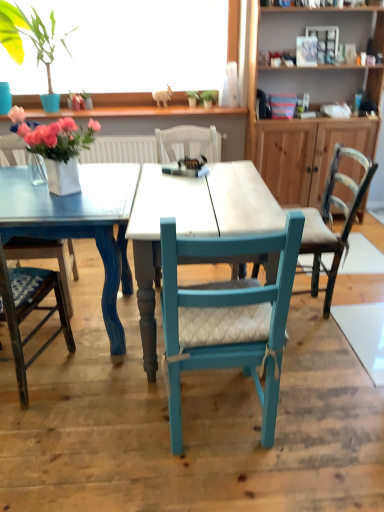
Question: Considering the relative positions of matte pink flowers at left and blue fabric cushioned chair at left, arranged as the 2th chair when viewed from the left, in the image provided, is matte pink flowers at left in front of blue fabric cushioned chair at left, arranged as the 2th chair when viewed from the left,?

Choices:
 (A) no
 (B) yes

Answer: (A)

Question: Considering the relative sizes of matte pink flowers at left and blue fabric cushioned chair at left, arranged as the 2th chair when viewed from the left, in the image provided, is matte pink flowers at left thinner than blue fabric cushioned chair at left, arranged as the 2th chair when viewed from the left,?

Choices:
 (A) no
 (B) yes

Answer: (B)

Question: Can you confirm if matte pink flowers at left is positioned to the left of blue fabric cushioned chair at left, arranged as the 2th chair when viewed from the left?

Choices:
 (A) yes
 (B) no

Answer: (B)

Question: Is matte pink flowers at left outside blue fabric cushioned chair at left, arranged as the 2th chair when viewed from the left?

Choices:
 (A) yes
 (B) no

Answer: (A)

Question: Considering the relative sizes of matte pink flowers at left and blue fabric cushioned chair at left, marked as the third chair in a right-to-left arrangement, in the image provided, is matte pink flowers at left wider than blue fabric cushioned chair at left, marked as the third chair in a right-to-left arrangement,?

Choices:
 (A) no
 (B) yes

Answer: (A)

Question: Looking at their shapes, would you say white wood table at center is wider or thinner than green leafy plant at upper left?

Choices:
 (A) wide
 (B) thin

Answer: (A)

Question: Considering their positions, is white wood table at center located in front of or behind green leafy plant at upper left?

Choices:
 (A) behind
 (B) front

Answer: (B)

Question: From a real-world perspective, relative to green leafy plant at upper left, is white wood table at center vertically above or below?

Choices:
 (A) below
 (B) above

Answer: (A)

Question: Is point (142, 291) closer or farther from the camera than point (36, 55)?

Choices:
 (A) farther
 (B) closer

Answer: (B)

Question: Considering the positions of point (210, 221) and point (342, 244), is point (210, 221) closer or farther from the camera than point (342, 244)?

Choices:
 (A) farther
 (B) closer

Answer: (B)

Question: Is white wood table at center wider or thinner than teal fabric chair at center, the 1th chair positioned from the right?

Choices:
 (A) wide
 (B) thin

Answer: (A)

Question: From a real-world perspective, is white wood table at center physically located above or below teal fabric chair at center, placed as the 4th chair when sorted from left to right?

Choices:
 (A) below
 (B) above

Answer: (A)

Question: From the image's perspective, is white wood table at center above or below teal fabric chair at center, placed as the 4th chair when sorted from left to right?

Choices:
 (A) above
 (B) below

Answer: (B)

Question: From the image's perspective, is white wood table at center above or below blue fabric cushioned chair at left, marked as the third chair in a right-to-left arrangement?

Choices:
 (A) below
 (B) above

Answer: (B)

Question: From their relative heights in the image, would you say white wood table at center is taller or shorter than blue fabric cushioned chair at left, marked as the third chair in a right-to-left arrangement?

Choices:
 (A) tall
 (B) short

Answer: (B)